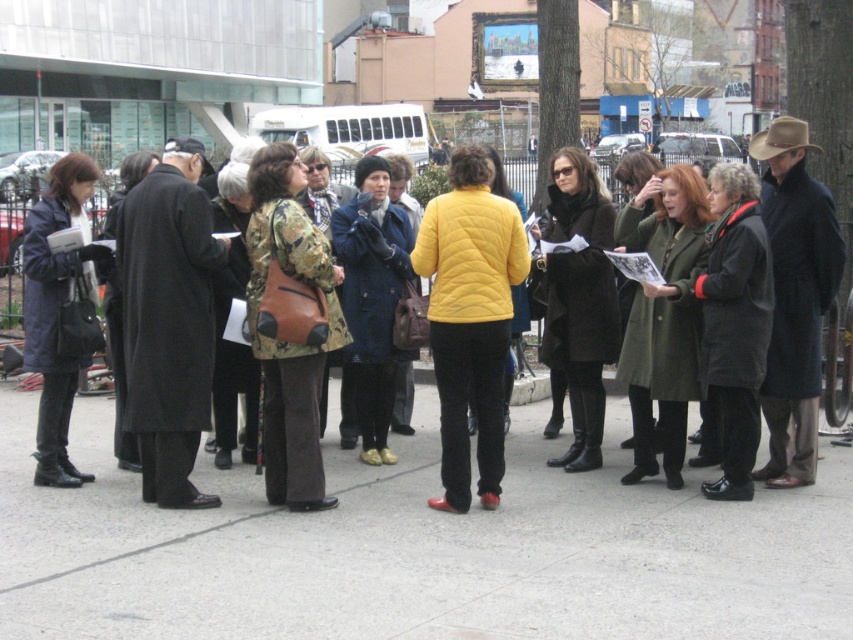
Question: Which point is closer to the camera?

Choices:
 (A) camouflage fabric jacket at center
 (B) gray concrete pavement at center
 (C) matte black coat at center
 (D) quilted navy coat at left

Answer: (B)

Question: Is the position of olive-green coat at center less distant than that of camouflage jacket at center?

Choices:
 (A) yes
 (B) no

Answer: (B)

Question: Which point is closer to the camera?

Choices:
 (A) matte black coat at center
 (B) camouflage jacket at center
 (C) camouflage fabric jacket at center
 (D) olive-green coat at center

Answer: (C)

Question: Which object is farther from the camera taking this photo?

Choices:
 (A) camouflage jacket at center
 (B) matte brown coat at center
 (C) gray concrete pavement at center
 (D) matte black coat at center

Answer: (D)

Question: Is matte black coat at center thinner than matte brown coat at center?

Choices:
 (A) no
 (B) yes

Answer: (B)

Question: Can you confirm if matte black coat at center is smaller than camouflage jacket at center?

Choices:
 (A) yes
 (B) no

Answer: (A)